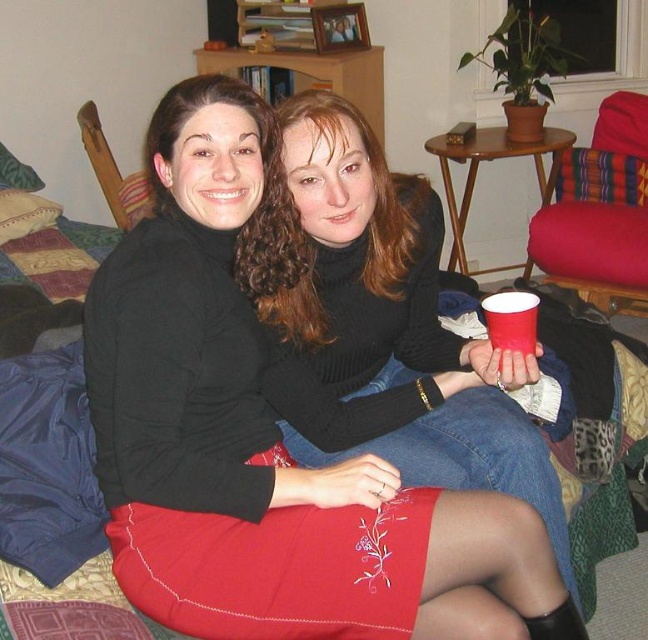
Which of these two, matte black sweater at center or black turtleneck sweater at center, stands shorter?

black turtleneck sweater at center is shorter.

Does matte black sweater at center have a lesser width compared to black turtleneck sweater at center?

No.

Which is in front, point (327, 275) or point (273, 280)?

Point (273, 280) is in front.

Find the location of a particular element. matte black sweater at center is located at coordinates click(x=389, y=332).

Does matte black sweater at center have a greater height compared to red paper cup at lower right?

Correct, matte black sweater at center is much taller as red paper cup at lower right.

Which is behind, point (275, 321) or point (531, 300)?

Point (275, 321)

Who is more distant from viewer, (428,337) or (529,317)?

Positioned behind is point (428,337).

I want to click on matte black sweater at center, so [389, 332].

Can you confirm if matte black sweater at center is thinner than embroidered satin skirt at lower center?

No, matte black sweater at center is not thinner than embroidered satin skirt at lower center.

Does point (422, 272) come farther from viewer compared to point (465, 417)?

That is True.

Who is more distant from viewer, [487,460] or [522,499]?

Point [487,460]

You are a GUI agent. You are given a task and a screenshot of the screen. Output one action in this format:
    pyautogui.click(x=<x>, y=<y>)
    Task: Click on the matte black sweater at center
    Image resolution: width=648 pixels, height=640 pixels.
    Given the screenshot: What is the action you would take?
    pyautogui.click(x=389, y=332)